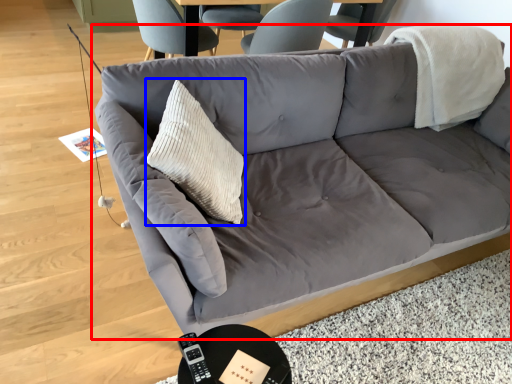
Question: Which object is further to the camera taking this photo, studio couch (highlighted by a red box) or throw pillow (highlighted by a blue box)?

Choices:
 (A) studio couch
 (B) throw pillow

Answer: (B)